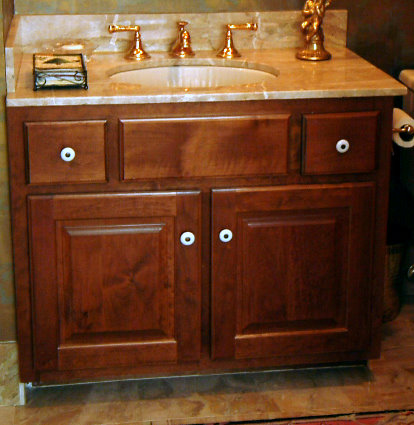
Find the location of `paper handtowels`. paper handtowels is located at coordinates click(59, 62).